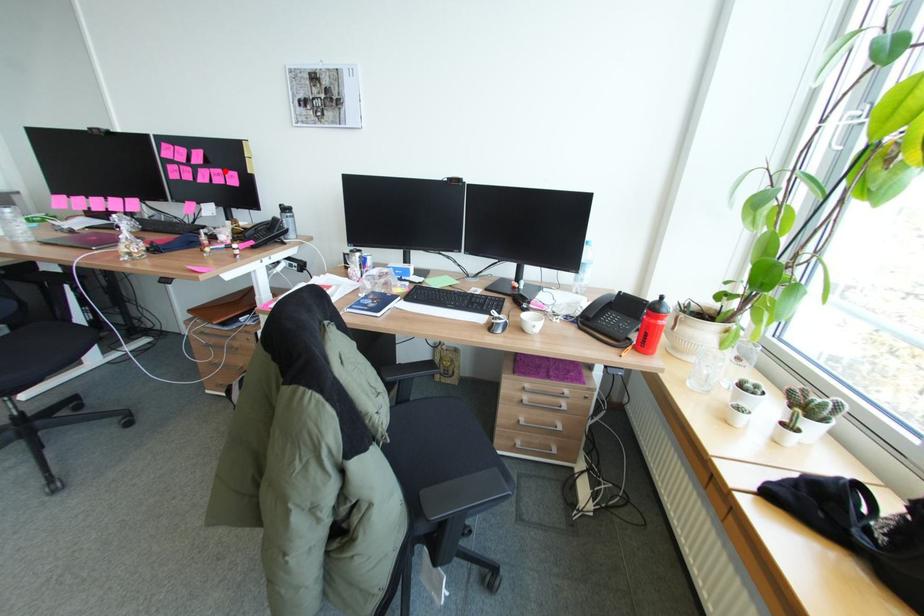
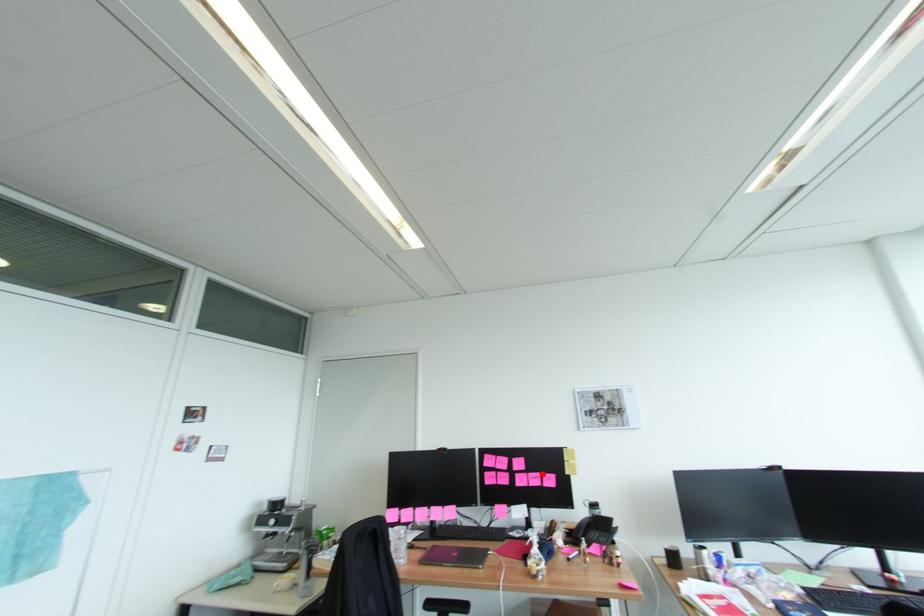
I am providing you with two images of the same scene from different viewpoints. A red point is marked on the first image and another point is marked on the second image. Does the point marked in image1 correspond to the same location as the one in image2?

Yes